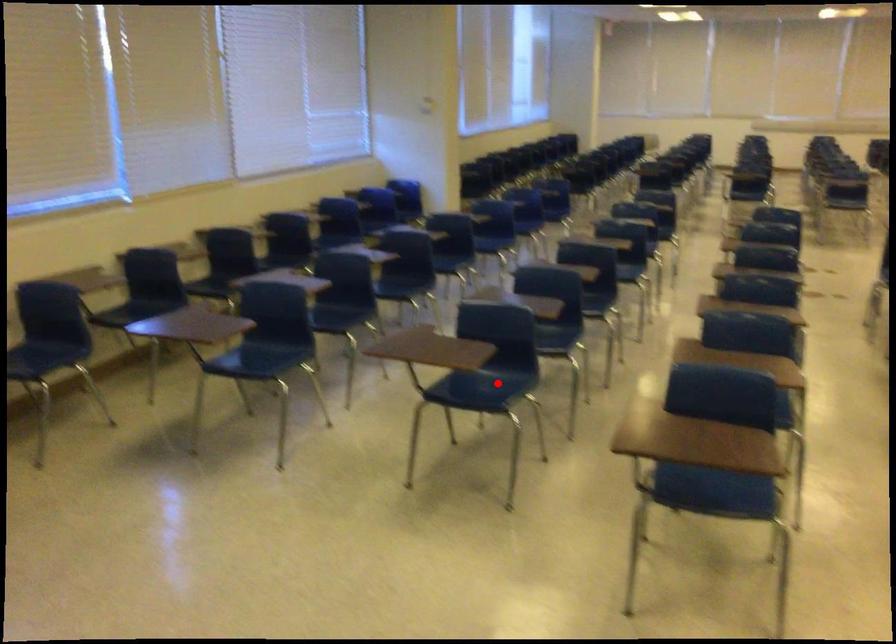
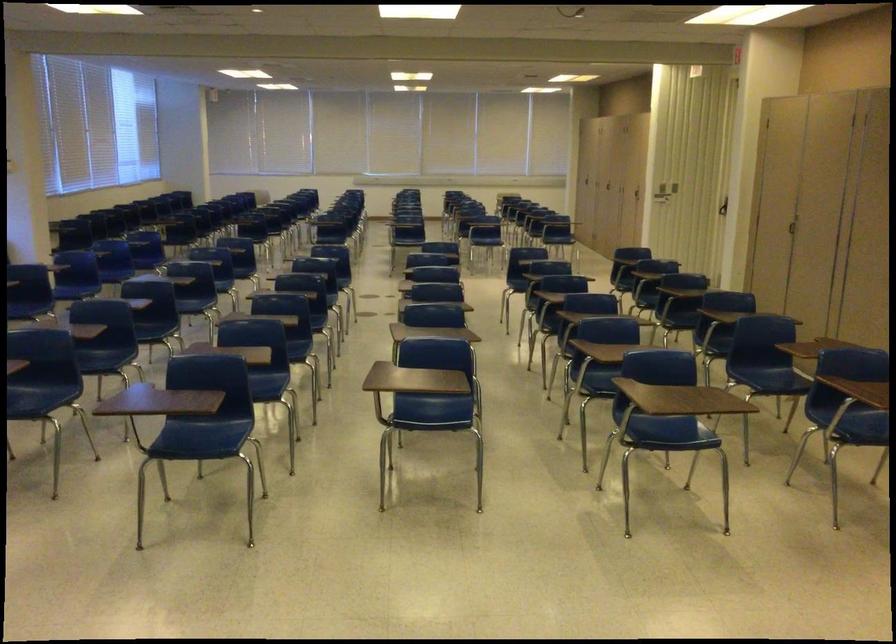
Question: A red point is marked in image1. In image2, is the corresponding 3D point closer to the camera or farther? Reply with the corresponding letter.

Choices:
 (A) The corresponding 3D point is closer.
 (B) The corresponding 3D point is farther.

Answer: (B)